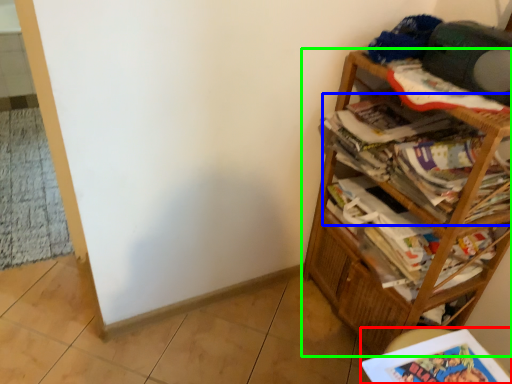
Question: Based on their relative distances, which object is nearer to book (highlighted by a red box)? Choose from magazine (highlighted by a blue box) and bookcase (highlighted by a green box).

Choices:
 (A) magazine
 (B) bookcase

Answer: (B)